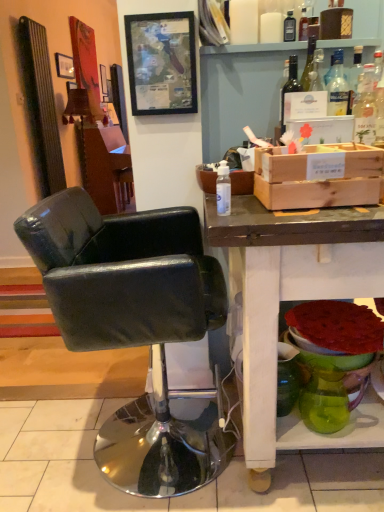
Describe the element at coordinates (162, 63) in the screenshot. I see `wooden framed map at upper center, which appears as the 1th picture frame when viewed from the right` at that location.

Find the location of a particular element. The height and width of the screenshot is (512, 384). wooden framed map at upper center, which is the second picture frame in back-to-front order is located at coordinates (162, 63).

What do you see at coordinates (292, 300) in the screenshot? The width and height of the screenshot is (384, 512). I see `matte white desk at lower right` at bounding box center [292, 300].

Measure the distance between transparent plastic bottle at center, which is the first bottle in front-to-back order, and camera.

transparent plastic bottle at center, which is the first bottle in front-to-back order, is 1.13 meters from camera.

Measure the distance between point (227, 174) and camera.

Point (227, 174) is 4.41 feet from camera.

The image size is (384, 512). Describe the element at coordinates (324, 401) in the screenshot. I see `green glass vase at lower right` at that location.

Find the location of a particular element. The width and height of the screenshot is (384, 512). matte black picture frame at upper left, which is counted as the 1th picture frame, starting from the back is located at coordinates tap(64, 66).

This screenshot has height=512, width=384. What are the coordinates of `wooden framed map at upper center, which is the second picture frame in back-to-front order` in the screenshot? It's located at (162, 63).

From a real-world perspective, is matte black picture frame at upper left, which appears as the second picture frame when viewed from the right, physically located above or below green glass vase at lower right?

matte black picture frame at upper left, which appears as the second picture frame when viewed from the right, is above green glass vase at lower right.

How many degrees apart are the facing directions of matte black picture frame at upper left, placed as the 2th picture frame when sorted from front to back, and green glass vase at lower right?

The facing directions of matte black picture frame at upper left, placed as the 2th picture frame when sorted from front to back, and green glass vase at lower right are 3.96 degrees apart.

From the image's perspective, which object appears higher, matte black picture frame at upper left, which is counted as the 1th picture frame, starting from the back, or green glass vase at lower right?

matte black picture frame at upper left, which is counted as the 1th picture frame, starting from the back, is shown above in the image.

In the scene shown: Which object is further away from the camera, transparent plastic bottle at center, which is the first bottle in front-to-back order, or wooden framed map at upper center, arranged as the 2th picture frame when viewed from the top?

wooden framed map at upper center, arranged as the 2th picture frame when viewed from the top, is further away from the camera.

Considering the points (218, 195) and (190, 94), which point is in front, point (218, 195) or point (190, 94)?

Point (218, 195)

Could you tell me if transparent plastic bottle at center, which is counted as the 3th bottle, starting from the back, is facing wooden framed map at upper center, which is counted as the first picture frame, starting from the bottom?

No, transparent plastic bottle at center, which is counted as the 3th bottle, starting from the back, is not oriented towards wooden framed map at upper center, which is counted as the first picture frame, starting from the bottom.

Can you tell me how much transparent plastic bottle at center, the first bottle positioned from the bottom, and wooden framed map at upper center, acting as the second picture frame starting from the left, differ in facing direction?

The facing directions of transparent plastic bottle at center, the first bottle positioned from the bottom, and wooden framed map at upper center, acting as the second picture frame starting from the left, are 90 degrees apart.

From a real-world perspective, relative to green glass vase at lower right, is wooden framed map at upper center, which appears as the 1th picture frame when viewed from the right, vertically above or below?

wooden framed map at upper center, which appears as the 1th picture frame when viewed from the right, is above green glass vase at lower right.

Is green glass vase at lower right at the back of wooden framed map at upper center, acting as the second picture frame starting from the left?

No, wooden framed map at upper center, acting as the second picture frame starting from the left, is not facing away from green glass vase at lower right.

From the image's perspective, is wooden framed map at upper center, which appears as the 1th picture frame when viewed from the right, above or below green glass vase at lower right?

Based on their image positions, wooden framed map at upper center, which appears as the 1th picture frame when viewed from the right, is located above green glass vase at lower right.

Can you confirm if wooden framed map at upper center, acting as the second picture frame starting from the left, is positioned to the right of green glass vase at lower right?

No.

Could you tell me if wooden vanity at center is facing transparent plastic bottle at center, which is the 3th bottle in top-to-bottom order?

No, wooden vanity at center is not facing towards transparent plastic bottle at center, which is the 3th bottle in top-to-bottom order.

Considering the relative sizes of wooden vanity at center and transparent plastic bottle at center, positioned as the third bottle in right-to-left order, in the image provided, is wooden vanity at center smaller than transparent plastic bottle at center, positioned as the third bottle in right-to-left order,?

Actually, wooden vanity at center might be larger than transparent plastic bottle at center, positioned as the third bottle in right-to-left order.

How different are the orientations of wooden vanity at center and transparent plastic bottle at center, the 1th bottle from the left, in degrees?

1.2 degrees.

From a real-world perspective, who is located higher, wooden vanity at center or transparent plastic bottle at center, positioned as the third bottle in right-to-left order?

transparent plastic bottle at center, positioned as the third bottle in right-to-left order, from a real-world perspective.

Could you tell me if black leather chair at center is facing green glass vase at lower right?

Yes.

Can green glass vase at lower right be found inside black leather chair at center?

That's incorrect, green glass vase at lower right is not inside black leather chair at center.

From the image's perspective, is translucent glass bottle at upper right, the 2th bottle from the top, above matte white desk at lower right?

Yes, from the image's perspective, translucent glass bottle at upper right, the 2th bottle from the top, is above matte white desk at lower right.

Is the position of translucent glass bottle at upper right, which appears as the 2th bottle when ordered from the bottom, less distant than that of matte white desk at lower right?

No, the depth of translucent glass bottle at upper right, which appears as the 2th bottle when ordered from the bottom, is greater than that of matte white desk at lower right.

Between translucent glass bottle at upper right, the 2th bottle from the front, and matte white desk at lower right, which one has smaller width?

Thinner between the two is translucent glass bottle at upper right, the 2th bottle from the front.

From the image's perspective, which object appears higher, wooden vanity at center or transparent glass bottle at upper center, positioned as the first bottle in top-to-bottom order?

wooden vanity at center is shown above in the image.

Which is in front, point (113, 141) or point (294, 27)?

Point (294, 27)

From the wooden vanity at center, count 1st bottles forward and point to it. Please provide its 2D coordinates.

[(289, 27)]

Based on the photo, based on their positions, is wooden vanity at center located to the left or right of transparent glass bottle at upper center, placed as the third bottle when sorted from left to right?

Based on their positions, wooden vanity at center is located to the left of transparent glass bottle at upper center, placed as the third bottle when sorted from left to right.

Where is `vase that is in front of the matte black picture frame at upper left, which appears as the second picture frame when viewed from the right`? vase that is in front of the matte black picture frame at upper left, which appears as the second picture frame when viewed from the right is located at coordinates (324, 401).

From the image's perspective, starting from the transparent plastic bottle at center, which is counted as the 3th bottle, starting from the back, which picture frame is the 1st one above? Please provide its 2D coordinates.

[(162, 63)]

Looking at the image, which one is located further to matte white desk at lower right, translucent glass bottle at upper right, the 2th bottle from the front, or black leather chair at center?

translucent glass bottle at upper right, the 2th bottle from the front, lies further to matte white desk at lower right than the other object.

When comparing their distances from matte white desk at lower right, does wooden crate at right or transparent glass bottle at upper center, the 3th bottle from the bottom, seem closer?

The object closer to matte white desk at lower right is wooden crate at right.

Looking at this image, when comparing their distances from translucent glass bottle at upper right, the 2th bottle from the front, does matte white desk at lower right or wooden vanity at center seem closer?

matte white desk at lower right.

When comparing their distances from wooden vanity at center, does transparent glass bottle at upper center, the 3th bottle from the bottom, or translucent glass bottle at upper right, placed as the 2th bottle when sorted from right to left, seem closer?

The object closer to wooden vanity at center is transparent glass bottle at upper center, the 3th bottle from the bottom.

From the image, which object appears to be farther from matte white desk at lower right, transparent plastic bottle at center, which is counted as the 3th bottle, starting from the back, or translucent glass bottle at upper right, which appears as the 2th bottle when ordered from the bottom?

translucent glass bottle at upper right, which appears as the 2th bottle when ordered from the bottom, is positioned further to the anchor matte white desk at lower right.

Considering their positions, is matte black picture frame at upper left, the 1th picture frame in the top-to-bottom sequence, positioned further to translucent glass bottle at upper right, placed as the second bottle when sorted from left to right, than black leather chair at center?

The object further to translucent glass bottle at upper right, placed as the second bottle when sorted from left to right, is matte black picture frame at upper left, the 1th picture frame in the top-to-bottom sequence.

Estimate the real-world distances between objects in this image. Which object is further from transparent glass bottle at upper center, the third bottle viewed from the front, wooden vanity at center or matte black picture frame at upper left, the 2th picture frame when ordered from bottom to top?

wooden vanity at center.

Estimate the real-world distances between objects in this image. Which object is closer to wooden vanity at center, wooden framed map at upper center, arranged as the 2th picture frame when viewed from the top, or wooden crate at right?

wooden framed map at upper center, arranged as the 2th picture frame when viewed from the top.

In order to click on box between wooden framed map at upper center, arranged as the 2th picture frame when viewed from the top, and black leather chair at center vertically in this screenshot , I will do `click(319, 177)`.

Locate an element on the screen. bottle between translucent glass bottle at upper right, which appears as the 2th bottle when ordered from the bottom, and green glass vase at lower right vertically is located at coordinates (223, 190).

You are a GUI agent. You are given a task and a screenshot of the screen. Output one action in this format:
    pyautogui.click(x=<x>, y=<y>)
    Task: Click on the bottle between translucent glass bottle at upper right, which appears as the 2th bottle when ordered from the bottom, and wooden vanity at center from front to back
    
    Given the screenshot: What is the action you would take?
    pyautogui.click(x=289, y=27)

Find the location of a particular element. box between transparent glass bottle at upper center, placed as the third bottle when sorted from left to right, and green glass vase at lower right, in the vertical direction is located at coordinates (319, 177).